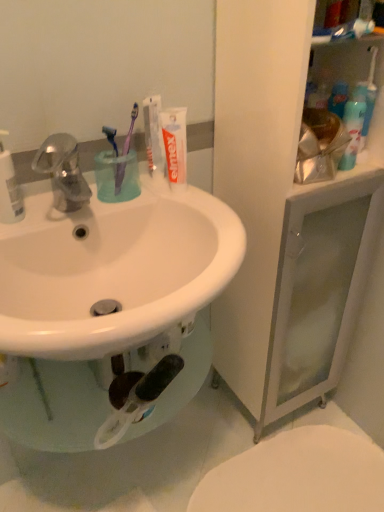
Locate an element on the screen. This screenshot has width=384, height=512. empty space that is ontop of white glossy toilet at lower right is located at coordinates (297, 472).